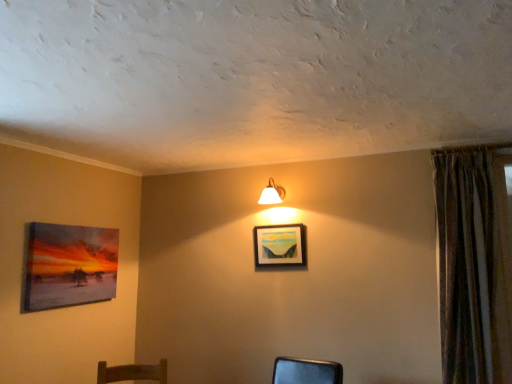
Question: Is matte canvas painting at left, the 2th picture frame viewed from the right, to the right of matte wooden picture frame at center, which ranks as the first picture frame in right-to-left order, from the viewer's perspective?

Choices:
 (A) no
 (B) yes

Answer: (A)

Question: Does matte canvas painting at left, positioned as the 1th picture frame in left-to-right order, have a greater width compared to matte wooden picture frame at center, the second picture frame in the left-to-right sequence?

Choices:
 (A) no
 (B) yes

Answer: (B)

Question: Are matte canvas painting at left, the 2th picture frame viewed from the right, and matte wooden picture frame at center, the second picture frame in the left-to-right sequence, far apart?

Choices:
 (A) no
 (B) yes

Answer: (B)

Question: From the image's perspective, is matte canvas painting at left, the 2th picture frame viewed from the right, above matte wooden picture frame at center, which ranks as the first picture frame in right-to-left order?

Choices:
 (A) no
 (B) yes

Answer: (A)

Question: Is matte canvas painting at left, positioned as the 1th picture frame in left-to-right order, facing away from matte wooden picture frame at center, which ranks as the first picture frame in right-to-left order?

Choices:
 (A) yes
 (B) no

Answer: (B)

Question: From the image's perspective, relative to white glossy wall lamp at upper center, is textured brown curtain at right above or below?

Choices:
 (A) below
 (B) above

Answer: (A)

Question: From a real-world perspective, is textured brown curtain at right physically located above or below white glossy wall lamp at upper center?

Choices:
 (A) below
 (B) above

Answer: (A)

Question: Is textured brown curtain at right in front of or behind white glossy wall lamp at upper center in the image?

Choices:
 (A) behind
 (B) front

Answer: (B)

Question: Visually, is textured brown curtain at right positioned to the left or to the right of white glossy wall lamp at upper center?

Choices:
 (A) right
 (B) left

Answer: (A)

Question: Considering the positions of matte canvas painting at left, the 2th picture frame viewed from the right, and matte wooden picture frame at center, the second picture frame in the left-to-right sequence, in the image, is matte canvas painting at left, the 2th picture frame viewed from the right, bigger or smaller than matte wooden picture frame at center, the second picture frame in the left-to-right sequence,?

Choices:
 (A) big
 (B) small

Answer: (A)

Question: Is matte canvas painting at left, the 2th picture frame viewed from the right, wider or thinner than matte wooden picture frame at center, which ranks as the first picture frame in right-to-left order?

Choices:
 (A) wide
 (B) thin

Answer: (A)

Question: From the image's perspective, is matte canvas painting at left, positioned as the 1th picture frame in left-to-right order, above or below matte wooden picture frame at center, the second picture frame in the left-to-right sequence?

Choices:
 (A) above
 (B) below

Answer: (B)

Question: Is matte canvas painting at left, positioned as the 1th picture frame in left-to-right order, in front of or behind matte wooden picture frame at center, which ranks as the first picture frame in right-to-left order, in the image?

Choices:
 (A) front
 (B) behind

Answer: (A)

Question: In terms of width, does matte canvas painting at left, positioned as the 1th picture frame in left-to-right order, look wider or thinner when compared to textured brown curtain at right?

Choices:
 (A) thin
 (B) wide

Answer: (A)

Question: In the image, is matte canvas painting at left, the 2th picture frame viewed from the right, on the left side or the right side of textured brown curtain at right?

Choices:
 (A) right
 (B) left

Answer: (B)